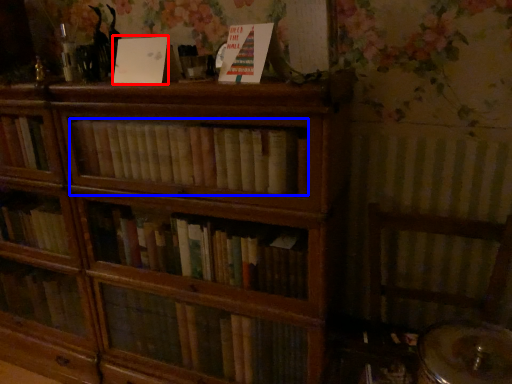
Question: Among these objects, which one is nearest to the camera, paperback book (highlighted by a red box) or book (highlighted by a blue box)?

Choices:
 (A) paperback book
 (B) book

Answer: (B)